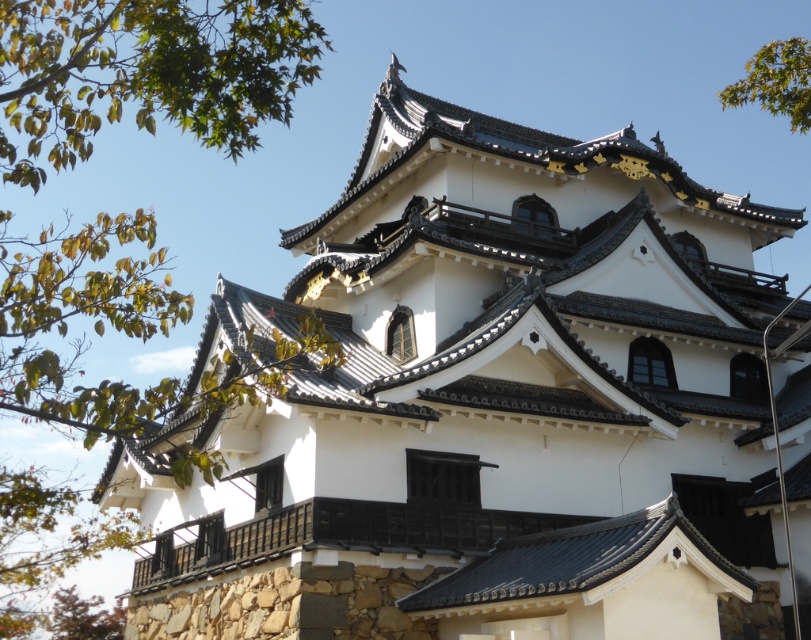
Question: Which point is closer to the camera taking this photo?

Choices:
 (A) (52, 404)
 (B) (727, 99)

Answer: (A)

Question: Is green leafy tree at upper left to the right of green leafy tree at upper right from the viewer's perspective?

Choices:
 (A) yes
 (B) no

Answer: (B)

Question: Among these points, which one is nearest to the camera?

Choices:
 (A) (745, 100)
 (B) (20, 44)

Answer: (B)

Question: Does green leafy tree at upper left have a lesser width compared to green leafy tree at upper right?

Choices:
 (A) yes
 (B) no

Answer: (B)

Question: Which point is closer to the camera?

Choices:
 (A) green leafy tree at upper right
 (B) green leafy tree at upper left

Answer: (B)

Question: Does green leafy tree at upper left have a lesser width compared to green leafy tree at upper right?

Choices:
 (A) no
 (B) yes

Answer: (A)